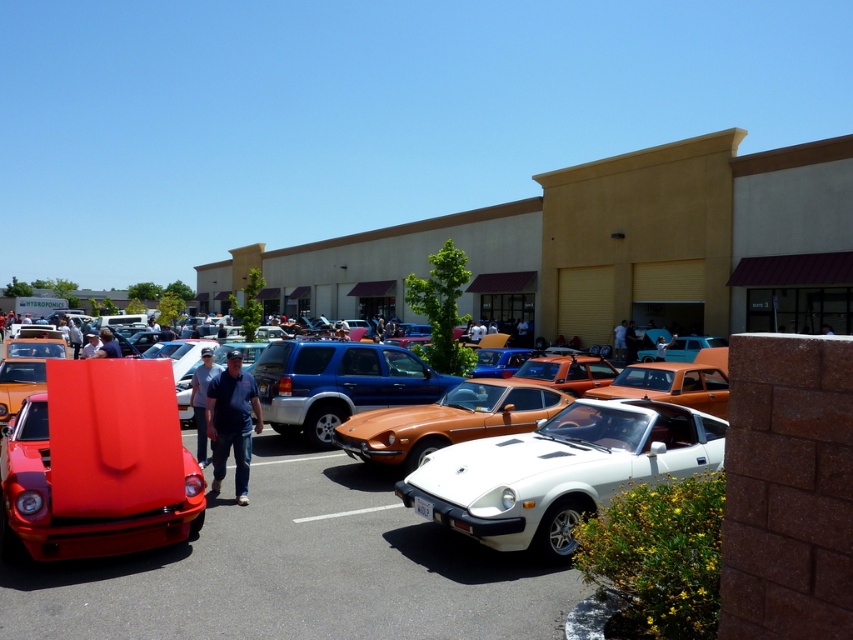
Does shiny orange car at center have a lesser height compared to orange matte sports car at center?

Yes.

Is point (9, 604) positioned behind point (334, 390)?

No, it is not.

Identify the location of shiny orange car at center. This screenshot has width=853, height=640. (296, 570).

Between white matte convertible at center and orange metallic sports car at center, which one has more height?

With more height is white matte convertible at center.

Between white matte convertible at center and orange metallic sports car at center, which one has less height?

Standing shorter between the two is orange metallic sports car at center.

Identify the location of white matte convertible at center. This screenshot has height=640, width=853. pyautogui.click(x=560, y=472).

This screenshot has width=853, height=640. I want to click on white matte convertible at center, so click(x=560, y=472).

Which is below, orange matte sports car at center or orange metallic sports car at center?

Positioned lower is orange metallic sports car at center.

Which is in front, point (271, 413) or point (408, 413)?

Point (408, 413) is in front.

What do you see at coordinates (338, 384) in the screenshot? I see `orange matte sports car at center` at bounding box center [338, 384].

At what (x,y) coordinates should I click in order to perform the action: click on orange matte sports car at center. Please return your answer as a coordinate pair (x, y). Looking at the image, I should click on (338, 384).